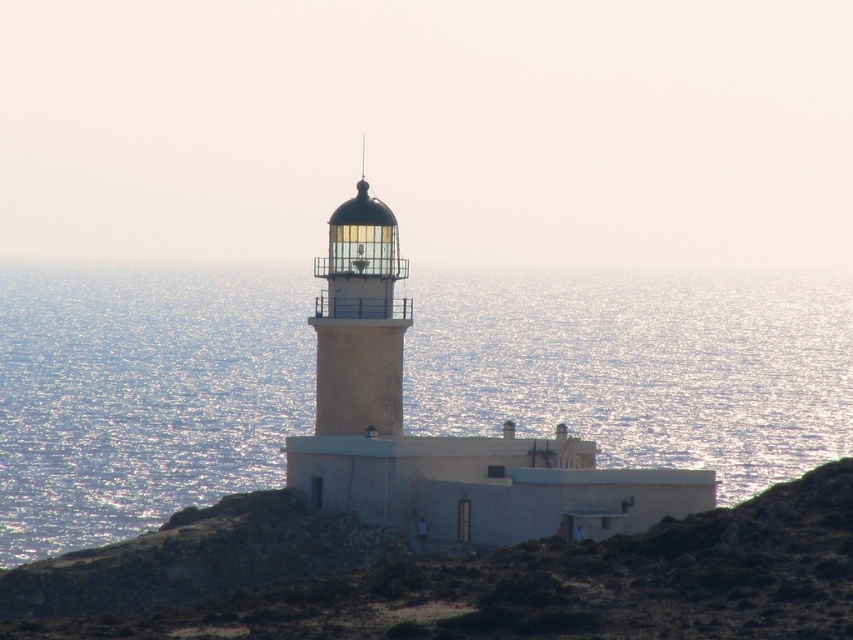
Does point (47, 406) come closer to viewer compared to point (331, 339)?

No, it is not.

Between point (608, 401) and point (357, 328), which one is positioned in front?

Point (357, 328) is more forward.

Does point (7, 284) come in front of point (344, 336)?

No, it is not.

I want to click on glistening silver water at center, so click(x=640, y=364).

Who is lower down, brown rocky hillside at center or white concrete lighthouse at center?

brown rocky hillside at center is below.

Does brown rocky hillside at center appear on the left side of white concrete lighthouse at center?

In fact, brown rocky hillside at center is to the right of white concrete lighthouse at center.

What do you see at coordinates (453, 577) in the screenshot?
I see `brown rocky hillside at center` at bounding box center [453, 577].

Identify the location of brown rocky hillside at center. (453, 577).

Looking at this image, does glistening silver water at center appear on the left side of brown rocky hillside at center?

Yes, glistening silver water at center is to the left of brown rocky hillside at center.

Find the location of `glistening silver water at center`. glistening silver water at center is located at coordinates (640, 364).

Who is more forward, (265, 371) or (712, 536)?

Point (712, 536) is in front.

Locate an element on the screen. Image resolution: width=853 pixels, height=640 pixels. glistening silver water at center is located at coordinates (640, 364).